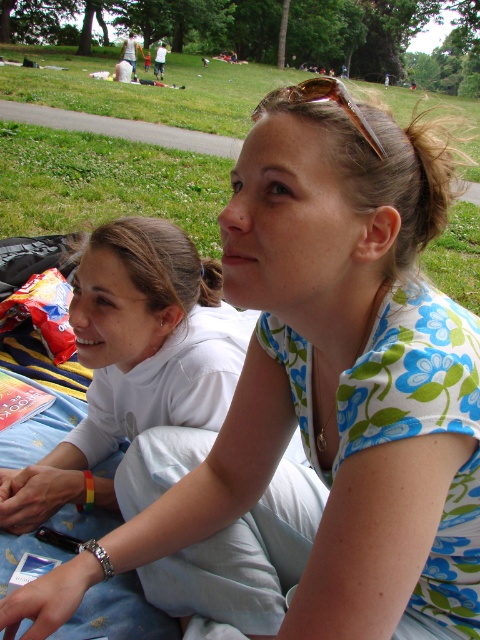
You are standing at the center of the park and want to walk to the green grass at upper center located at point (x=106, y=186). Which direction should you head?

The green grass at upper center is located at point (x=106, y=186), so you should head north.

You are a drone operator trying to capture a photo of the two people sitting on the light blue blanket. The camera is focused on the green grass at upper center. What coordinates should you adjust the camera to ensure it captures both individuals?

The green grass at upper center is located at coordinates point (106, 186). To capture both individuals, adjust the camera to this coordinate point.

You are planning to take a photo of the green grass at upper center and the gold metallic sunglasses at upper center. Which object should you focus on if you want to capture the larger one in your shot?

The green grass at upper center should be focused on because it is larger in size than the gold metallic sunglasses at upper center.